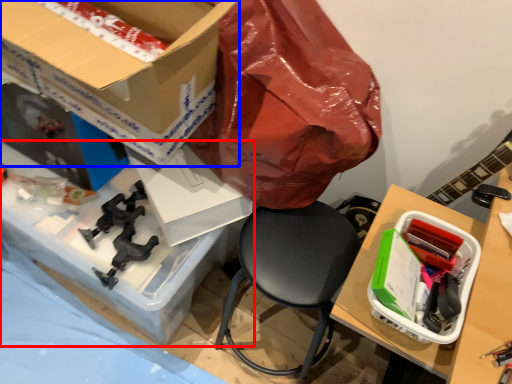
Question: Which point is further to the camera, desk (highlighted by a red box) or box (highlighted by a blue box)?

Choices:
 (A) desk
 (B) box

Answer: (A)